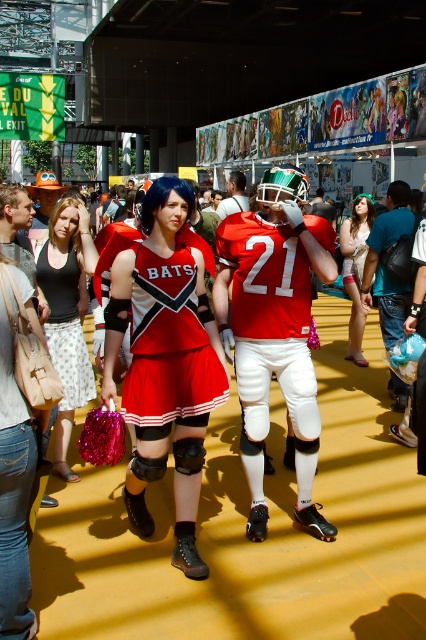
Between point (207, 396) and point (216, 276), which one is positioned in front?

Positioned in front is point (207, 396).

Who is positioned more to the left, matte red cheerleader outfit at center or matte red football uniform at center?

matte red cheerleader outfit at center

Between point (210, 324) and point (317, 269), which one is positioned behind?

Point (317, 269)

Locate an element on the screen. matte red cheerleader outfit at center is located at coordinates (164, 362).

Between matte red cheerleader outfit at center and matte white dress at center, which one is positioned lower?

matte red cheerleader outfit at center is below.

Does matte red cheerleader outfit at center have a smaller size compared to matte white dress at center?

Yes, matte red cheerleader outfit at center is smaller than matte white dress at center.

The height and width of the screenshot is (640, 426). Find the location of `matte red cheerleader outfit at center`. matte red cheerleader outfit at center is located at coordinates (164, 362).

Which is more to the right, matte red cheerleading uniform at center or matte black tank top at center?

Positioned to the right is matte red cheerleading uniform at center.

Between point (192, 284) and point (66, 236), which one is positioned in front?

Positioned in front is point (192, 284).

At what (x,y) coordinates should I click in order to perform the action: click on matte red cheerleading uniform at center. Please return your answer as a coordinate pair (x, y). The image size is (426, 640). Looking at the image, I should click on (169, 346).